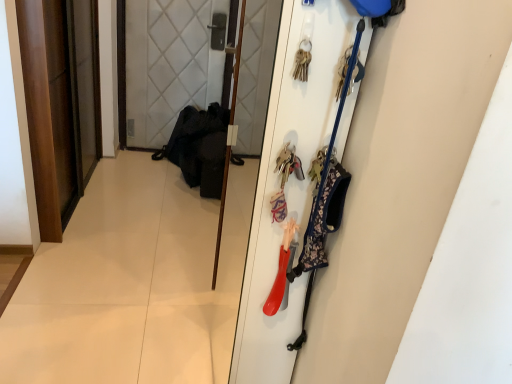
Locate an element on the screen. free space in front of wooden door at left, the 2th door from the right is located at coordinates (88, 261).